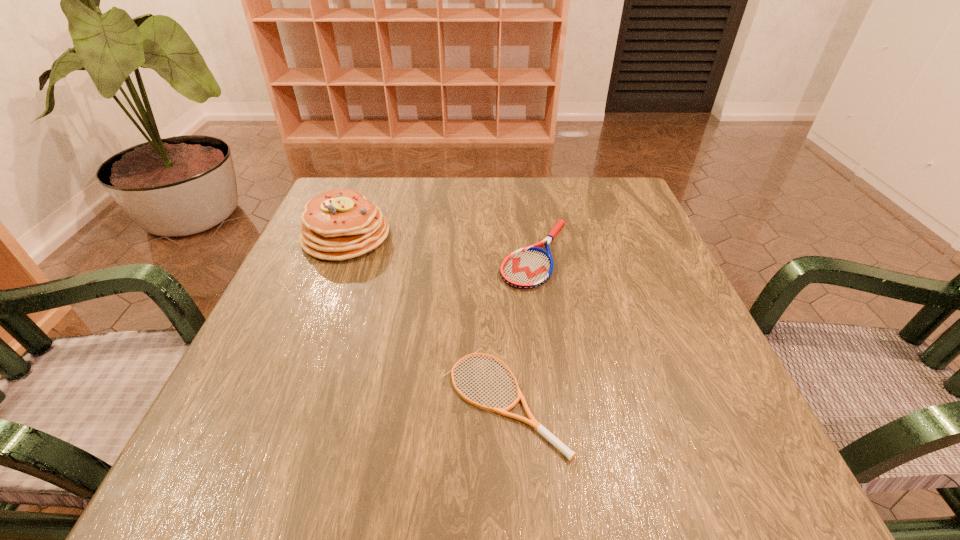
The width and height of the screenshot is (960, 540). Find the location of `free space at the near right corner of the desktop`. free space at the near right corner of the desktop is located at coordinates pyautogui.click(x=705, y=498).

Image resolution: width=960 pixels, height=540 pixels. What are the coordinates of `free point between the farther tennis racket and the tallest object` in the screenshot? It's located at [x=441, y=245].

You are a GUI agent. You are given a task and a screenshot of the screen. Output one action in this format:
    pyautogui.click(x=<x>, y=<y>)
    Task: Click on the vacant region between the leftmost object and the shorter tennis racket
    The height and width of the screenshot is (540, 960).
    Given the screenshot: What is the action you would take?
    pyautogui.click(x=424, y=318)

Where is `free space between the pancake and the second tallest object`? Image resolution: width=960 pixels, height=540 pixels. free space between the pancake and the second tallest object is located at coordinates (441, 245).

The height and width of the screenshot is (540, 960). I want to click on free space that is in between the farther tennis racket and the tallest object, so click(x=441, y=245).

I want to click on vacant space in between the taller tennis racket and the nearest object, so click(x=519, y=327).

Image resolution: width=960 pixels, height=540 pixels. What are the coordinates of `vacant area that lies between the second tallest object and the leftmost object` in the screenshot? It's located at 441,245.

Locate an element on the screen. The width and height of the screenshot is (960, 540). empty space between the second tallest object and the nearest object is located at coordinates (519, 327).

At what (x,y) coordinates should I click in order to perform the action: click on empty space that is in between the taller tennis racket and the tallest object. Please return your answer as a coordinate pair (x, y). This screenshot has width=960, height=540. Looking at the image, I should click on (441, 245).

Image resolution: width=960 pixels, height=540 pixels. Find the location of `free space between the shortest object and the pancake`. free space between the shortest object and the pancake is located at coordinates (424, 318).